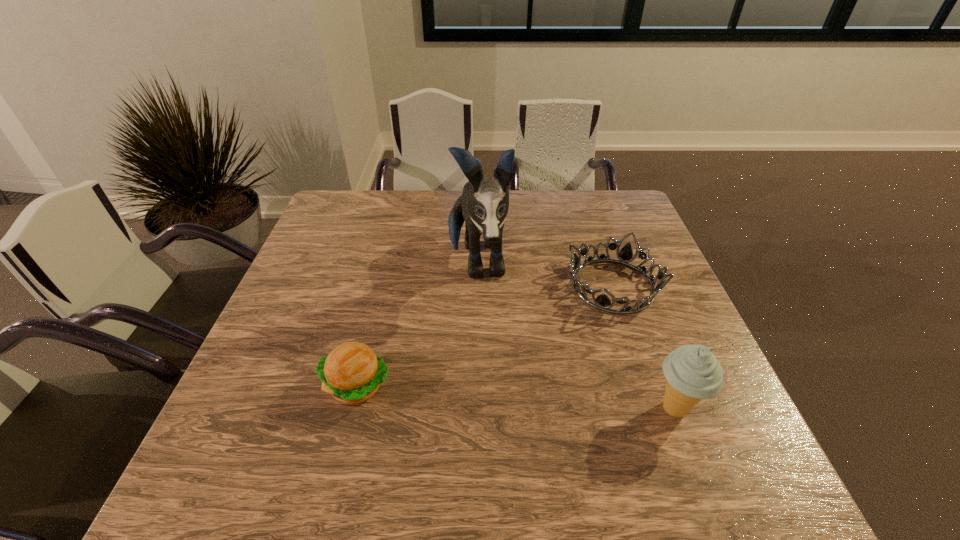
Locate an element on the screen. The height and width of the screenshot is (540, 960). the leftmost object is located at coordinates (352, 372).

Image resolution: width=960 pixels, height=540 pixels. In order to click on hamburger in this screenshot , I will do `click(352, 372)`.

Image resolution: width=960 pixels, height=540 pixels. In order to click on the third shortest object in this screenshot , I will do `click(692, 372)`.

Locate an element on the screen. This screenshot has height=540, width=960. the shortest object is located at coordinates pos(602,302).

Find the location of a particular element. puppy is located at coordinates (484, 203).

This screenshot has width=960, height=540. I want to click on the tallest object, so click(x=484, y=203).

Locate an element on the screen. This screenshot has height=540, width=960. free space located on the left of the third tallest object is located at coordinates (279, 386).

Find the location of a particular element. This screenshot has width=960, height=540. free space located 0.170m on the left of the second tallest object is located at coordinates (563, 409).

The image size is (960, 540). I want to click on vacant space situated 0.360m on the front-facing side of the shortest object, so [542, 435].

What are the coordinates of `vacant space located on the front-facing side of the shortest object` in the screenshot? It's located at (585, 346).